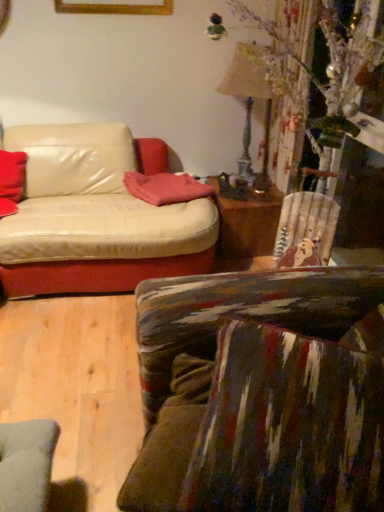
Question: Is textured multicolored fabric couch at lower right taller or shorter than pink fabric pillow at center, positioned as the 2th pillow in left-to-right order?

Choices:
 (A) short
 (B) tall

Answer: (B)

Question: Is textured multicolored fabric couch at lower right bigger or smaller than pink fabric pillow at center, which is the 1th pillow from right to left?

Choices:
 (A) big
 (B) small

Answer: (A)

Question: Which object is the closest to the textured multicolored fabric couch at lower right?

Choices:
 (A) wooden table at center
 (B) matte red cushion at left, the first pillow viewed from the left
 (C) pink fabric pillow at center, which is the 1th pillow from right to left
 (D) metallic gold lamp at upper right

Answer: (C)

Question: Which object is the closest to the matte red cushion at left, the first pillow viewed from the left?

Choices:
 (A) textured multicolored fabric couch at lower right
 (B) pink fabric pillow at center, which is the 1th pillow from right to left
 (C) metallic gold lamp at upper right
 (D) wooden table at center

Answer: (B)